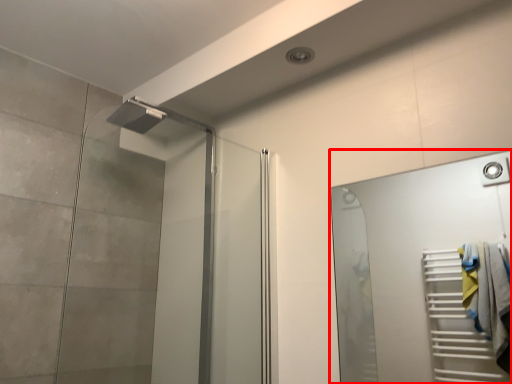
Question: From the image's perspective, what is the correct spatial positioning of door (annotated by the red box) in reference to screen door?

Choices:
 (A) above
 (B) below

Answer: (B)